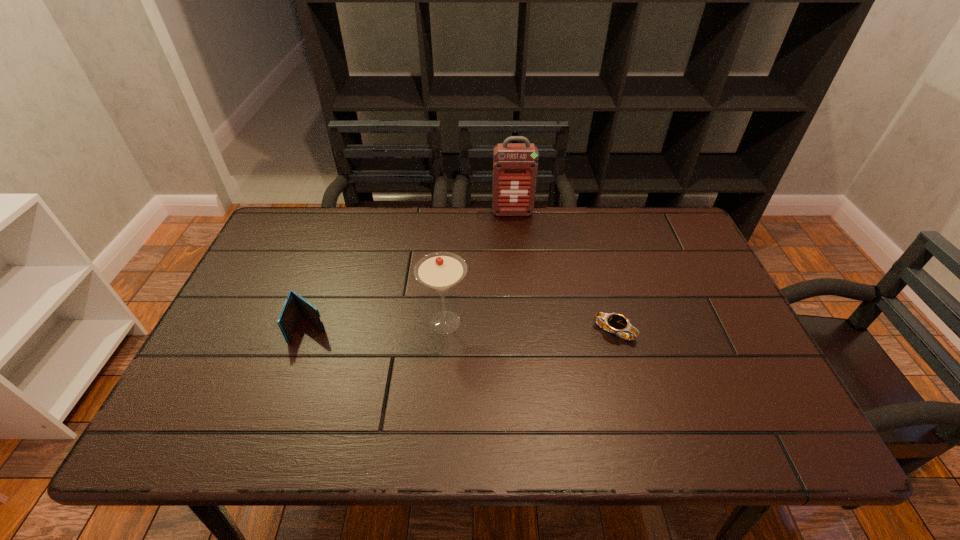
Locate an element on the screen. The height and width of the screenshot is (540, 960). vacant point located between the rightmost object and the third object from left to right is located at coordinates (564, 272).

Identify the location of vacant space in between the wallet and the farthest object. The width and height of the screenshot is (960, 540). (411, 271).

Locate an element on the screen. The width and height of the screenshot is (960, 540). free space between the martini and the rightmost object is located at coordinates (530, 327).

This screenshot has height=540, width=960. What are the coordinates of `free area in between the martini and the tallest object` in the screenshot? It's located at (479, 267).

Identify the location of unoccupied area between the third object from right to left and the second object from right to left. Image resolution: width=960 pixels, height=540 pixels. (479, 267).

Locate an element on the screen. free point between the wallet and the second tallest object is located at coordinates (377, 325).

The width and height of the screenshot is (960, 540). Identify the location of vacant space in between the tallest object and the leftmost object. (411, 271).

Where is `vacant area between the leftmost object and the rightmost object`? The image size is (960, 540). vacant area between the leftmost object and the rightmost object is located at coordinates (463, 330).

Locate an element on the screen. The height and width of the screenshot is (540, 960). vacant space that is in between the watch and the leftmost object is located at coordinates coord(463,330).

The image size is (960, 540). Find the location of `object identified as the second closest to the second object from left to right`. object identified as the second closest to the second object from left to right is located at coordinates (618, 324).